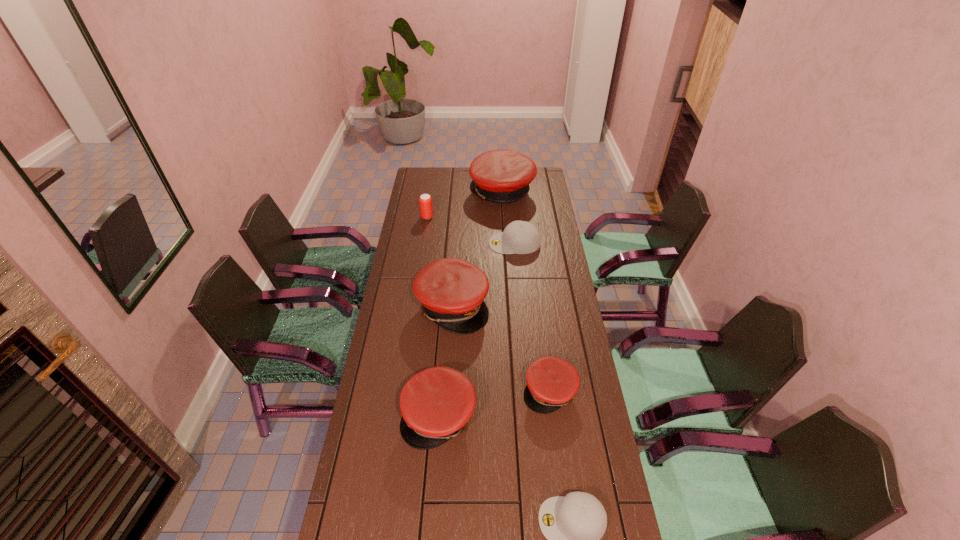
Where is `object that is at the far edge`? object that is at the far edge is located at coordinates (503, 176).

At what (x,y) coordinates should I click in order to perform the action: click on beer can that is at the left edge. Please return your answer as a coordinate pair (x, y). The height and width of the screenshot is (540, 960). Looking at the image, I should click on [425, 201].

The height and width of the screenshot is (540, 960). Find the location of `object positioned at the far right corner`. object positioned at the far right corner is located at coordinates (503, 176).

The width and height of the screenshot is (960, 540). In order to click on free space at the left edge of the desktop in this screenshot , I will do `click(411, 240)`.

This screenshot has width=960, height=540. I want to click on free space at the right edge, so click(533, 194).

Identify the location of vacant space at the far right corner. (537, 184).

The width and height of the screenshot is (960, 540). I want to click on free point between the second tallest object and the smallest red cap, so click(x=501, y=348).

You are a GUI agent. You are given a task and a screenshot of the screen. Output one action in this format:
    pyautogui.click(x=<x>, y=<y>)
    Task: Click on the free spot between the second tallest cap and the smallest red cap
    The width and height of the screenshot is (960, 540).
    Given the screenshot: What is the action you would take?
    pyautogui.click(x=501, y=348)

Locate an element on the screen. The image size is (960, 540). free area in between the farthest red cap and the smallest red cap is located at coordinates (526, 292).

The height and width of the screenshot is (540, 960). What are the coordinates of `free space between the fourth nearest cap and the smallest red cap` in the screenshot? It's located at (501, 348).